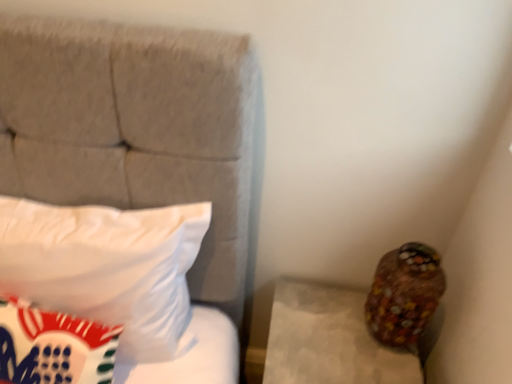
The width and height of the screenshot is (512, 384). In order to click on white soft pillow at left in this screenshot , I will do `click(106, 267)`.

Measure the distance between point (180, 262) and camera.

Point (180, 262) and camera are 3.33 feet apart from each other.

The height and width of the screenshot is (384, 512). Describe the element at coordinates (106, 267) in the screenshot. I see `white soft pillow at left` at that location.

Image resolution: width=512 pixels, height=384 pixels. Describe the element at coordinates (404, 294) in the screenshot. I see `multicolored glass vase at lower right` at that location.

I want to click on multicolored glass vase at lower right, so coord(404,294).

Measure the distance between multicolored glass vase at lower right and camera.

They are 37.56 inches apart.

In order to click on white soft pillow at left in this screenshot , I will do `click(106, 267)`.

Considering the relative positions of white soft pillow at left and multicolored glass vase at lower right in the image provided, is white soft pillow at left to the left or to the right of multicolored glass vase at lower right?

white soft pillow at left is positioned on multicolored glass vase at lower right's left side.

Between white soft pillow at left and multicolored glass vase at lower right, which one is positioned in front?

white soft pillow at left is in front.

Is point (31, 269) more distant than point (407, 262)?

That is False.

From the image's perspective, which is above, white soft pillow at left or multicolored glass vase at lower right?

white soft pillow at left is shown above in the image.

Based on the photo, from a real-world perspective, between white soft pillow at left and multicolored glass vase at lower right, who is vertically lower?

multicolored glass vase at lower right, from a real-world perspective.

Which of these two, white soft pillow at left or multicolored glass vase at lower right, is thinner?

Thinner between the two is multicolored glass vase at lower right.

Consider the image. Considering the relative sizes of white soft pillow at left and multicolored glass vase at lower right in the image provided, is white soft pillow at left shorter than multicolored glass vase at lower right?

No.

Considering the relative sizes of white soft pillow at left and multicolored glass vase at lower right in the image provided, is white soft pillow at left smaller than multicolored glass vase at lower right?

No.

Is white soft pillow at left inside or outside of multicolored glass vase at lower right?

white soft pillow at left is spatially situated outside multicolored glass vase at lower right.

Are white soft pillow at left and multicolored glass vase at lower right beside each other?

There is a gap between white soft pillow at left and multicolored glass vase at lower right.

Is multicolored glass vase at lower right at the back of white soft pillow at left?

That's not correct — white soft pillow at left is not looking away from multicolored glass vase at lower right.

Can you tell me how much white soft pillow at left and multicolored glass vase at lower right differ in facing direction?

They differ by 1.24 degrees in their facing directions.

You are a GUI agent. You are given a task and a screenshot of the screen. Output one action in this format:
    pyautogui.click(x=<x>, y=<y>)
    Task: Click on the pillow that is on the left side of multicolored glass vase at lower right
    
    Given the screenshot: What is the action you would take?
    pyautogui.click(x=106, y=267)

Is multicolored glass vase at lower right at the left side of white soft pillow at left?

No, multicolored glass vase at lower right is not to the left of white soft pillow at left.

From the picture: Does multicolored glass vase at lower right lie in front of white soft pillow at left?

No, multicolored glass vase at lower right is behind white soft pillow at left.

Between point (412, 307) and point (125, 254), which one is positioned behind?

Point (412, 307)

From the image's perspective, would you say multicolored glass vase at lower right is positioned over white soft pillow at left?

No, from the image's perspective, multicolored glass vase at lower right is not over white soft pillow at left.

From a real-world perspective, is multicolored glass vase at lower right physically located above or below white soft pillow at left?

Clearly, from a real-world perspective, multicolored glass vase at lower right is below white soft pillow at left.

Which object is wider, multicolored glass vase at lower right or white soft pillow at left?

white soft pillow at left is wider.

Between multicolored glass vase at lower right and white soft pillow at left, which one has more height?

white soft pillow at left is taller.

Considering the relative sizes of multicolored glass vase at lower right and white soft pillow at left in the image provided, is multicolored glass vase at lower right smaller than white soft pillow at left?

Yes, multicolored glass vase at lower right is smaller than white soft pillow at left.

Is white soft pillow at left inside multicolored glass vase at lower right?

That's incorrect, white soft pillow at left is not inside multicolored glass vase at lower right.

Is multicolored glass vase at lower right with white soft pillow at left?

There is a gap between multicolored glass vase at lower right and white soft pillow at left.

Is multicolored glass vase at lower right facing towards white soft pillow at left?

No, multicolored glass vase at lower right is not facing towards white soft pillow at left.

How many degrees apart are the facing directions of multicolored glass vase at lower right and white soft pillow at left?

They differ by 1.24 degrees in their facing directions.

Locate an element on the screen. The width and height of the screenshot is (512, 384). stuff behind the white soft pillow at left is located at coordinates (404, 294).

What are the coordinates of `stuff directly beneath the white soft pillow at left (from a real-world perspective)` in the screenshot? It's located at (404, 294).

Locate an element on the screen. Image resolution: width=512 pixels, height=384 pixels. pillow above the multicolored glass vase at lower right (from the image's perspective) is located at coordinates (106, 267).